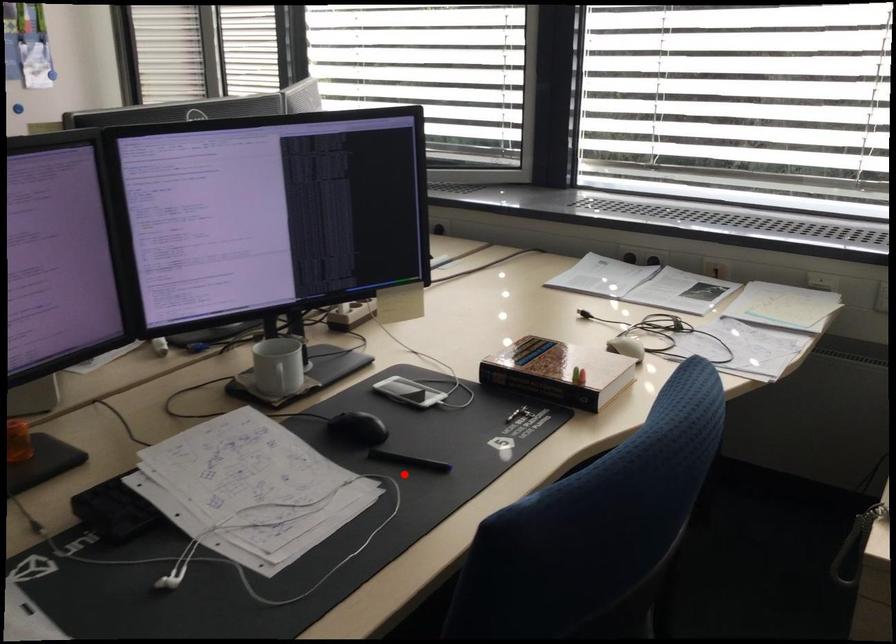
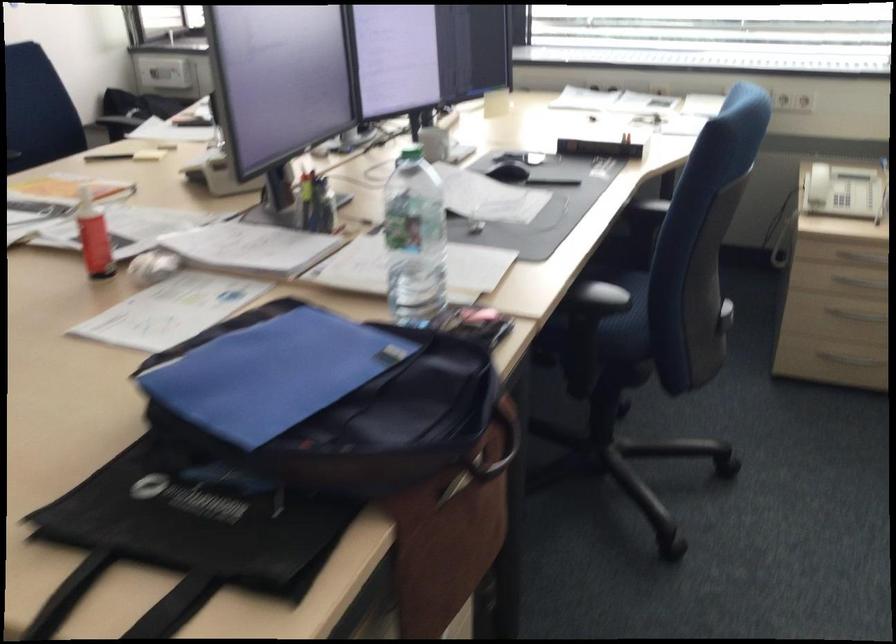
Find the pixel in the second image that matches the highlighted location in the first image.

(555, 182)